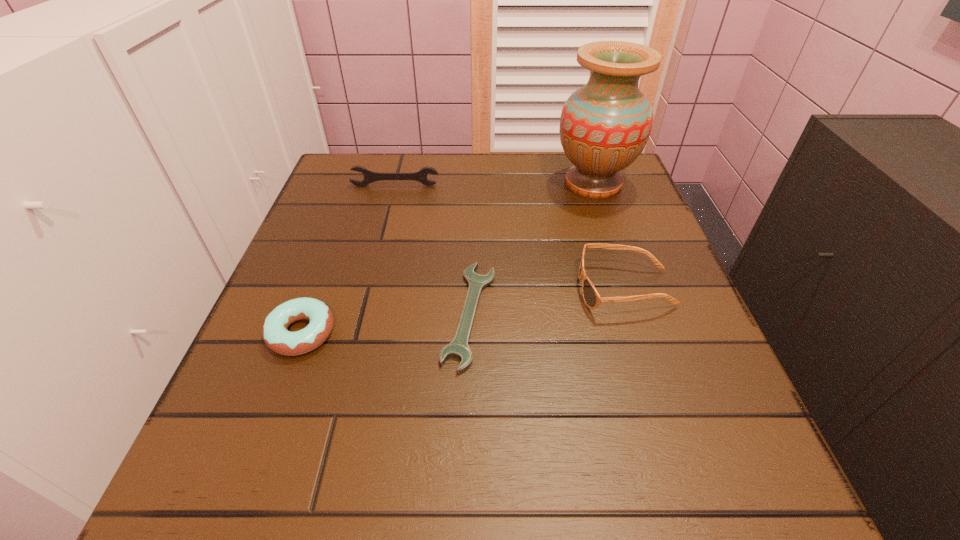
Where is `object positioned at the far left corner`? object positioned at the far left corner is located at coordinates (370, 176).

This screenshot has height=540, width=960. I want to click on object present at the far right corner, so click(604, 126).

Find the location of a particular element. blank space at the far edge of the desktop is located at coordinates point(559,194).

At what (x,y) coordinates should I click in order to perform the action: click on free region at the near edge. Please return your answer as a coordinate pair (x, y). Image resolution: width=960 pixels, height=540 pixels. Looking at the image, I should click on (477, 504).

Identify the location of free space at the left edge of the desktop. (314, 214).

Where is `vacant area at the right edge of the desktop`? This screenshot has height=540, width=960. vacant area at the right edge of the desktop is located at coordinates (595, 286).

Image resolution: width=960 pixels, height=540 pixels. In the image, there is a desktop. Identify the location of blank space at the far left corner. (362, 163).

This screenshot has height=540, width=960. What are the coordinates of `free space at the far right corner of the desktop` in the screenshot? It's located at (623, 173).

Identify the location of free region at the near right corner of the desktop. (643, 454).

This screenshot has height=540, width=960. Identify the location of empty space that is in between the shorter wrench and the second shortest object. (386, 323).